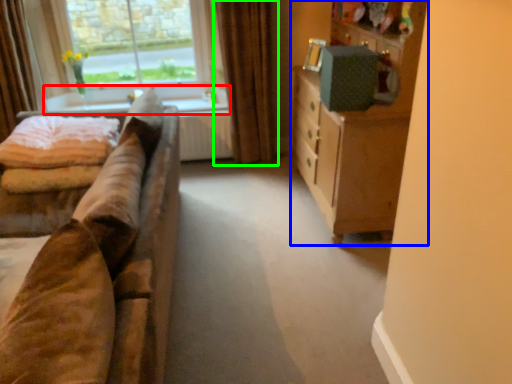
Question: Which object is positioned farthest from window sill (highlighted by a red box)? Select from cabinetry (highlighted by a blue box) and curtain (highlighted by a green box).

Choices:
 (A) cabinetry
 (B) curtain

Answer: (A)